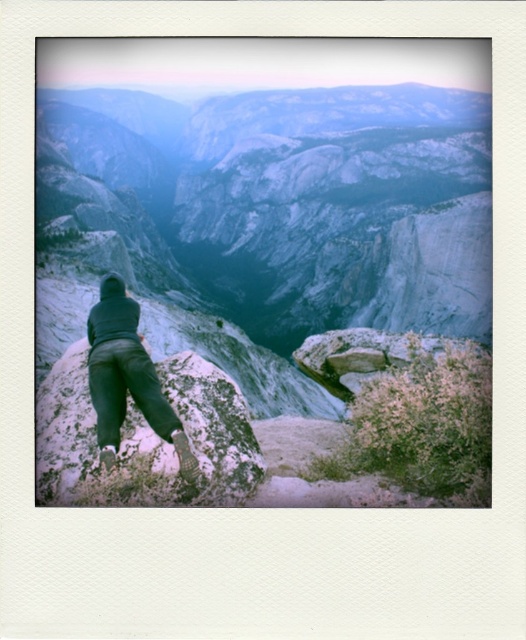
Question: Where is white textured rock at center located in relation to dark gray pants at center in the image?

Choices:
 (A) above
 (B) below

Answer: (B)

Question: Which object appears closest to the camera in this image?

Choices:
 (A) smooth granite rock at center
 (B) white textured rock at center

Answer: (B)

Question: Which of the following is the closest to the observer?

Choices:
 (A) (145, 499)
 (B) (447, 289)
 (C) (145, 387)

Answer: (A)

Question: Observing the image, what is the correct spatial positioning of white textured rock at center in reference to dark gray pants at center?

Choices:
 (A) below
 (B) above

Answer: (A)

Question: Which point is closer to the camera?

Choices:
 (A) (49, 464)
 (B) (112, 428)

Answer: (A)

Question: Is smooth granite rock at center thinner than dark gray pants at center?

Choices:
 (A) yes
 (B) no

Answer: (B)